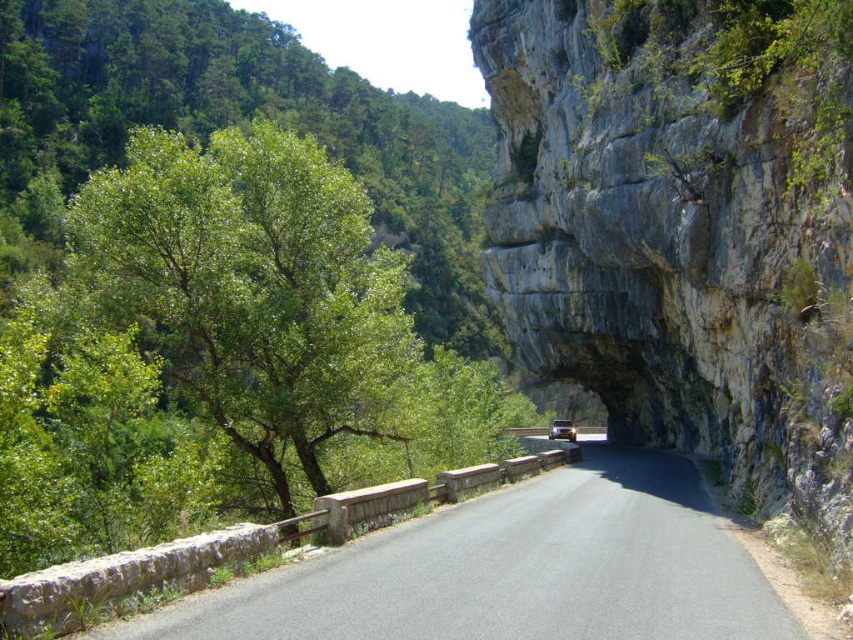
Question: Which point is farther to the camera?

Choices:
 (A) (711, 104)
 (B) (561, 422)
 (C) (544, 589)

Answer: (B)

Question: Which object appears farthest from the camera in this image?

Choices:
 (A) metallic gold car at center
 (B) rocky gray at center

Answer: (A)

Question: Considering the relative positions of rocky gray at center and asphalt road at center in the image provided, where is rocky gray at center located with respect to asphalt road at center?

Choices:
 (A) left
 (B) right

Answer: (B)

Question: Which object appears farthest from the camera in this image?

Choices:
 (A) metallic gold car at center
 (B) asphalt road at center
 (C) rocky gray at center

Answer: (A)

Question: Considering the relative positions of rocky gray at center and metallic gold car at center in the image provided, where is rocky gray at center located with respect to metallic gold car at center?

Choices:
 (A) below
 (B) above

Answer: (B)

Question: Does rocky gray at center appear under asphalt road at center?

Choices:
 (A) no
 (B) yes

Answer: (A)